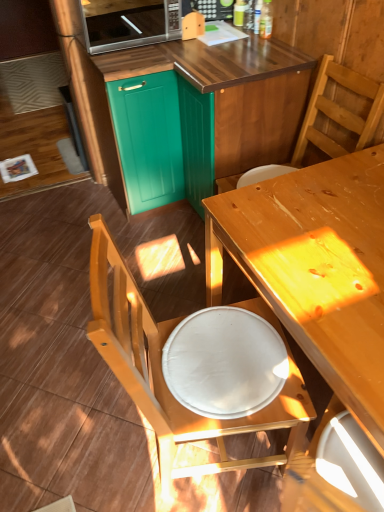
Where is `empty space that is ontop of white glossy plate at lower center (from a real-world perspective)`? The height and width of the screenshot is (512, 384). empty space that is ontop of white glossy plate at lower center (from a real-world perspective) is located at coordinates (223, 349).